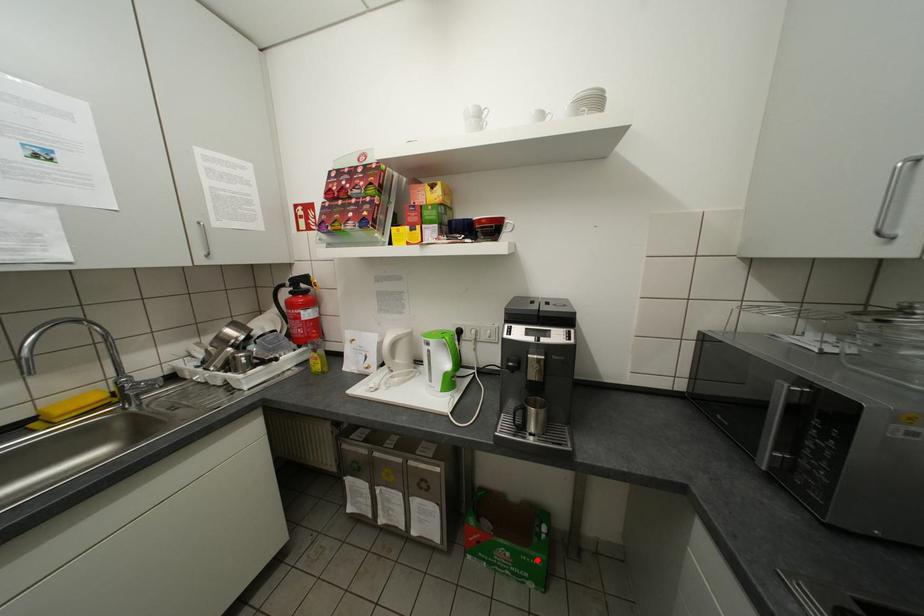
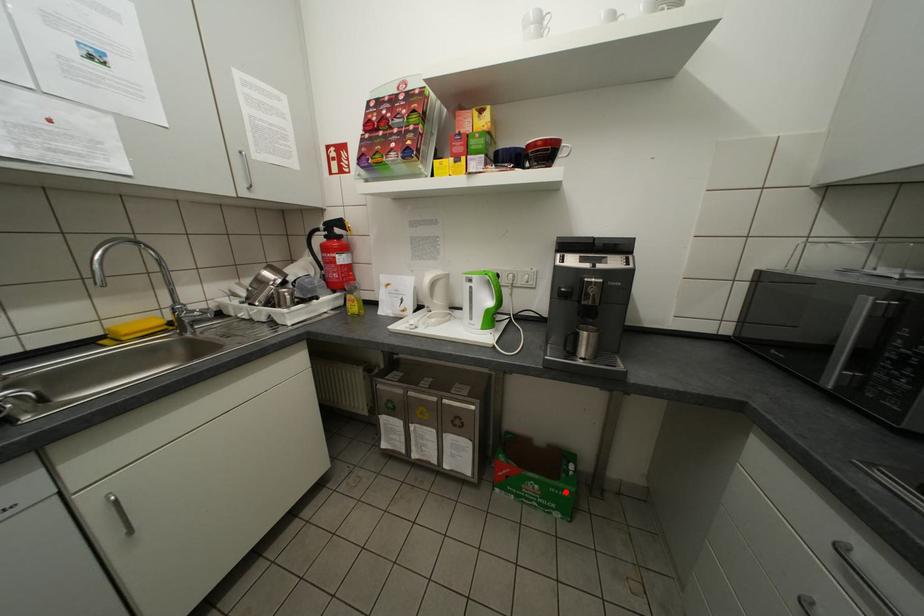
I am providing you with two images of the same scene from different viewpoints. A red point is marked on the first image and another point is marked on the second image. Are the points marked in image1 and image2 representing the same 3D position?

Yes